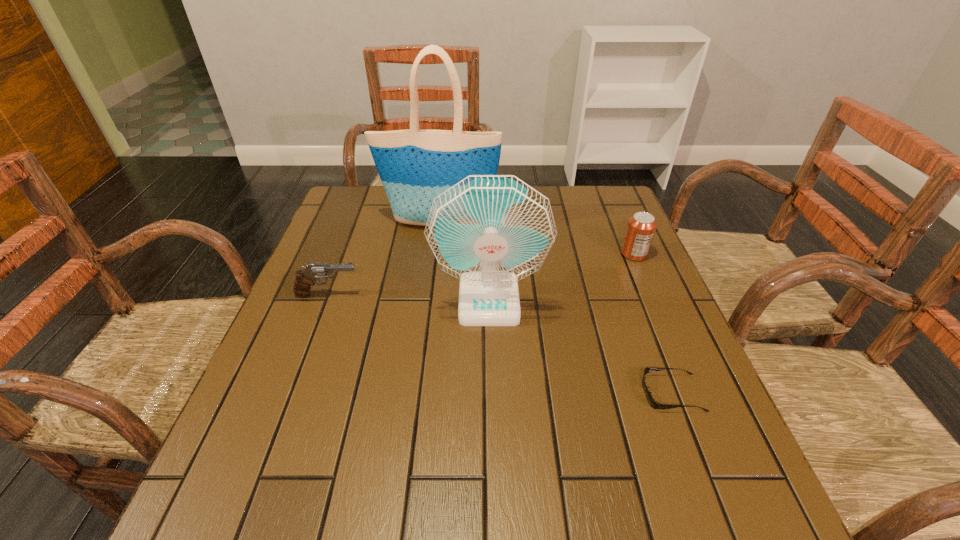
In order to click on free region located 0.290m at the barrel of the second shortest object in this screenshot , I will do `click(480, 295)`.

At what (x,y) coordinates should I click in order to perform the action: click on free spot located on the front-facing side of the shortest object. Please return your answer as a coordinate pair (x, y). The image size is (960, 540). Looking at the image, I should click on (443, 393).

Image resolution: width=960 pixels, height=540 pixels. I want to click on vacant space located 0.380m on the front-facing side of the shortest object, so click(447, 393).

What are the coordinates of `vacant space positioned on the front-facing side of the shortest object` in the screenshot? It's located at (550, 393).

Identify the location of object that is positioned at the far edge. The width and height of the screenshot is (960, 540). (415, 166).

The height and width of the screenshot is (540, 960). Identify the location of tote bag situated at the left edge. (415, 166).

Where is `pistol at the left edge`? The image size is (960, 540). pistol at the left edge is located at coordinates (305, 278).

Where is `can located at the right edge`? This screenshot has height=540, width=960. can located at the right edge is located at coordinates (641, 227).

This screenshot has width=960, height=540. I want to click on sunglasses present at the right edge, so click(x=653, y=403).

At what (x,y) coordinates should I click in order to perform the action: click on object located in the far left corner section of the desktop. Please return your answer as a coordinate pair (x, y). The width and height of the screenshot is (960, 540). Looking at the image, I should click on (415, 166).